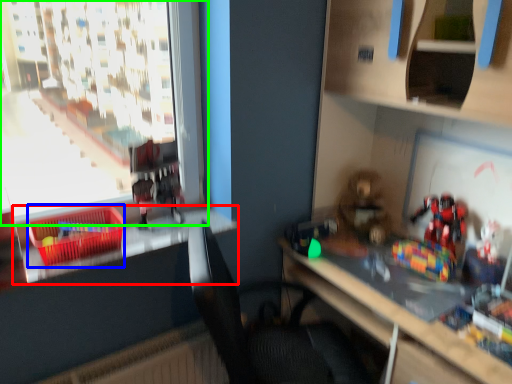
Question: Which is farther away from window sill (highlighted by a red box)? crate (highlighted by a blue box) or window (highlighted by a green box)?

Choices:
 (A) crate
 (B) window

Answer: (B)